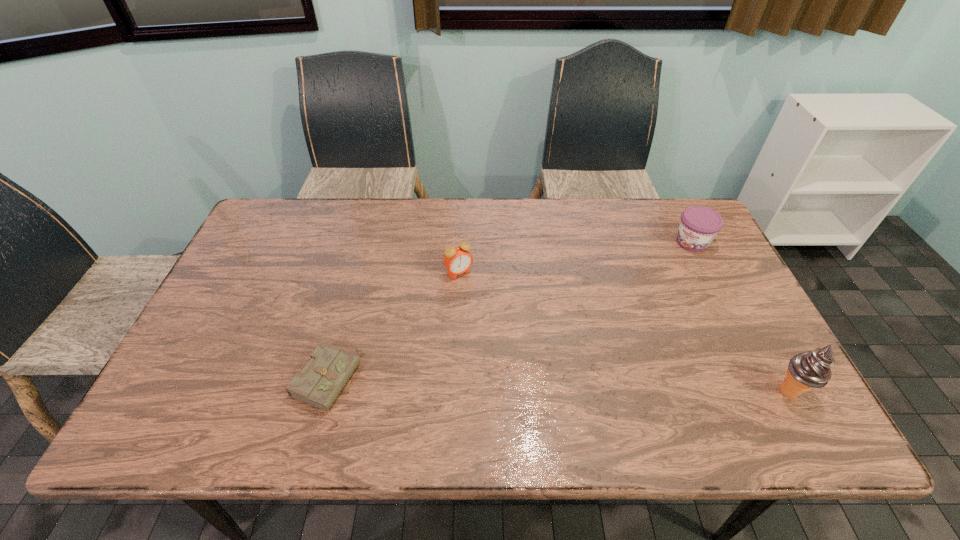
Locate an element on the screen. This screenshot has height=540, width=960. vacant space that satisfies the following two spatial constraints: 1. on the front side of the icecream; 2. on the left side of the jam is located at coordinates (768, 391).

Locate an element on the screen. Image resolution: width=960 pixels, height=540 pixels. free spot that satisfies the following two spatial constraints: 1. on the front side of the jam; 2. on the left side of the tallest object is located at coordinates (768, 391).